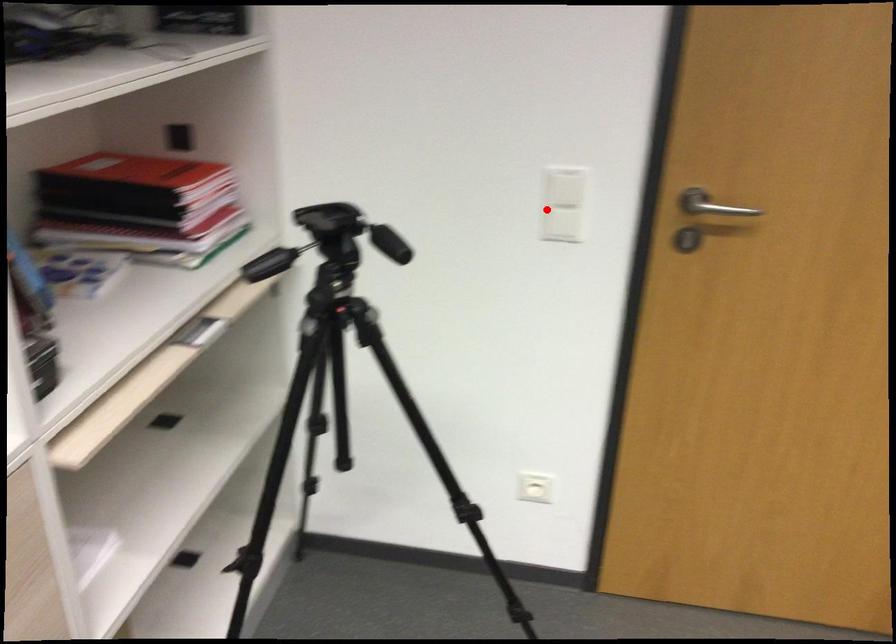
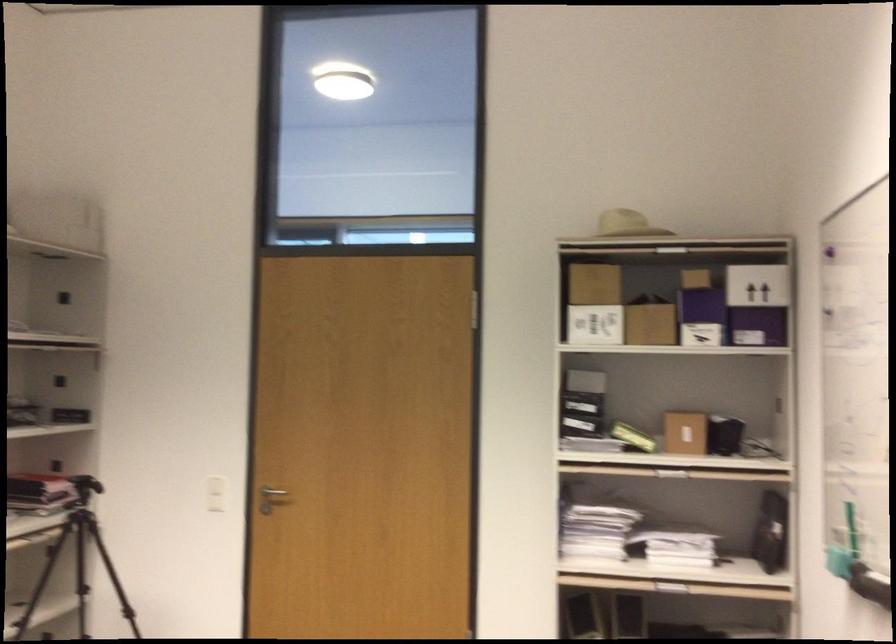
Question: I am providing you with two images of the same scene from different viewpoints. Given a red point in image1, look at the same physical point in image2. Is it:

Choices:
 (A) Closer to the viewpoint
 (B) Farther from the viewpoint

Answer: (B)